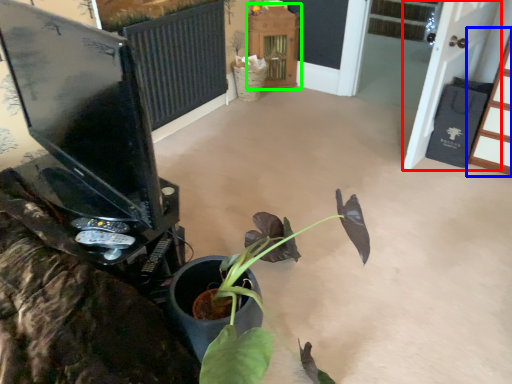
Question: Which is nearer to the screen door (highlighted by a red box)? furniture (highlighted by a blue box) or furniture (highlighted by a green box).

Choices:
 (A) furniture
 (B) furniture

Answer: (A)